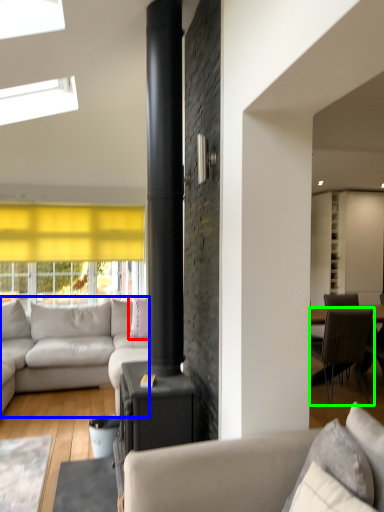
Question: Based on their relative distances, which object is nearer to pillow (highlighted by a red box)? Choose from studio couch (highlighted by a blue box) and chair (highlighted by a green box).

Choices:
 (A) studio couch
 (B) chair

Answer: (A)